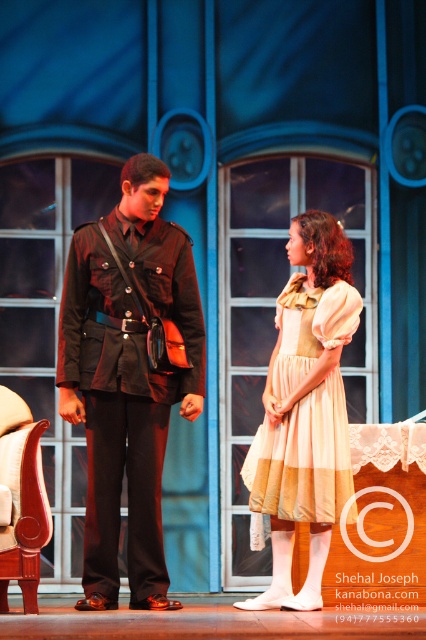
Question: Which object appears farthest from the camera in this image?

Choices:
 (A) matte black uniform at center
 (B) striped cotton dress at center

Answer: (B)

Question: Can you confirm if matte black uniform at center is positioned below striped cotton dress at center?

Choices:
 (A) no
 (B) yes

Answer: (A)

Question: Does matte black uniform at center appear under striped cotton dress at center?

Choices:
 (A) no
 (B) yes

Answer: (A)

Question: Observing the image, what is the correct spatial positioning of matte black uniform at center in reference to striped cotton dress at center?

Choices:
 (A) left
 (B) right

Answer: (A)

Question: Among these points, which one is nearest to the camera?

Choices:
 (A) (348, 285)
 (B) (129, 483)

Answer: (B)